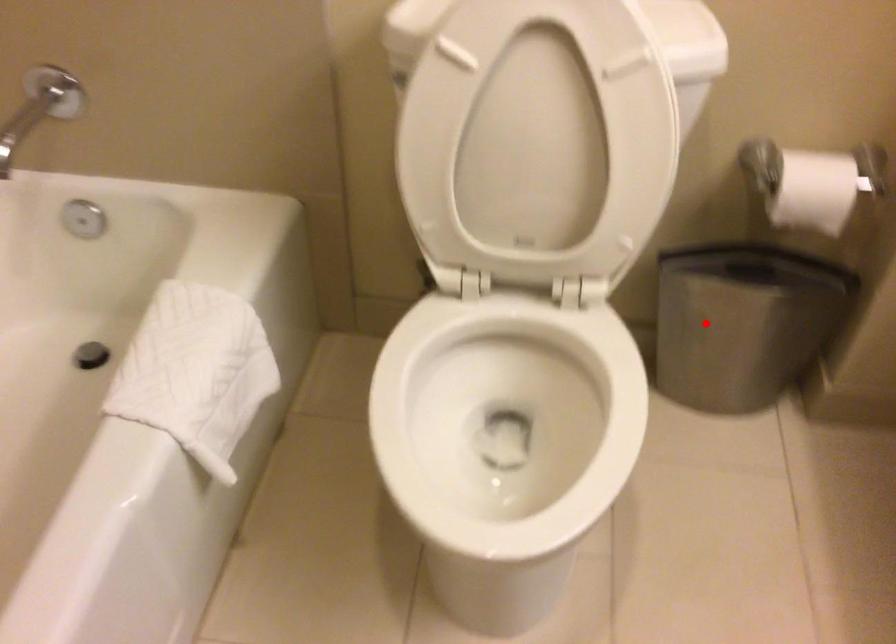
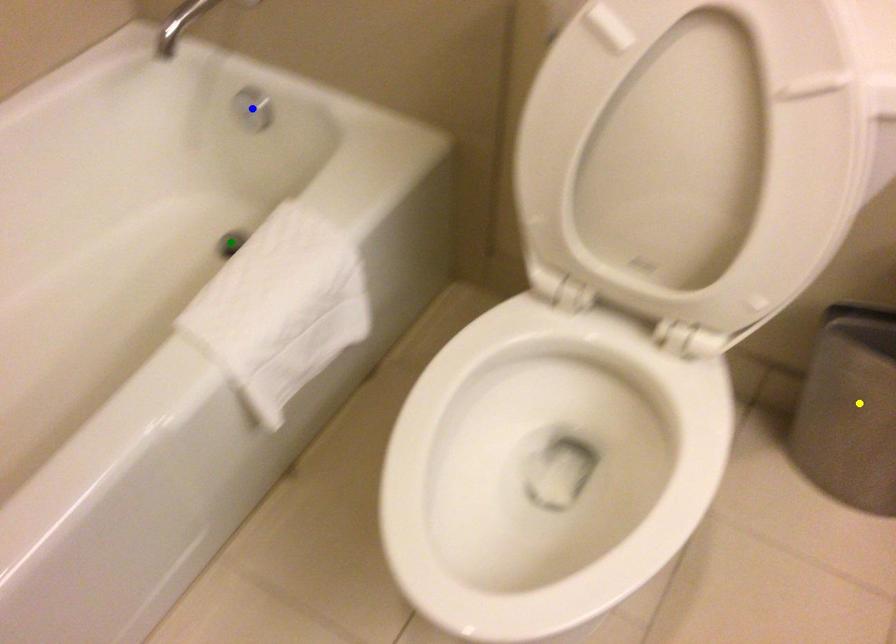
Question: I am providing you with two images of the same scene from different viewpoints. A red point is marked on the first image. You are given multiple points on the second image. Which mark in image 2 goes with the point in image 1?

Choices:
 (A) yellow point
 (B) green point
 (C) blue point

Answer: (A)